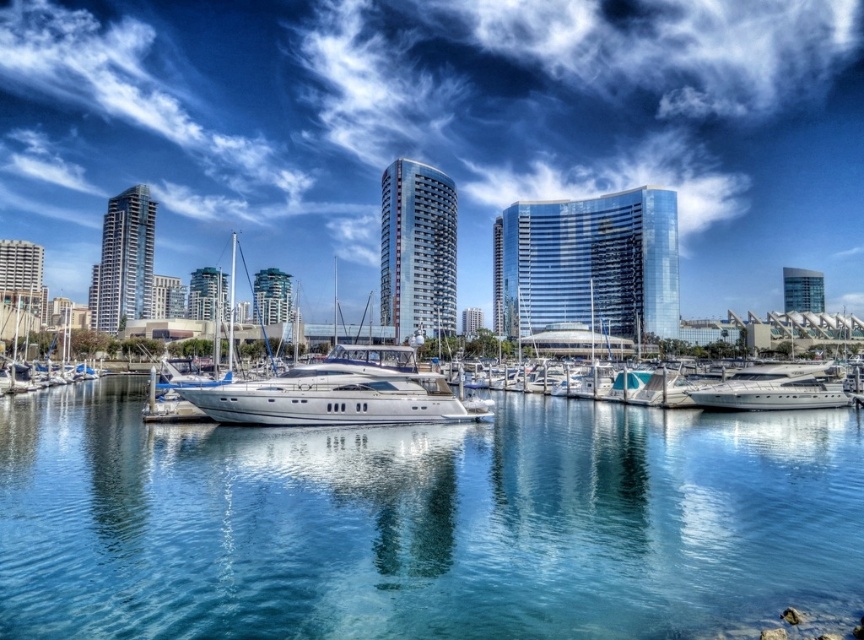
Which is in front, point (359, 348) or point (132, 312)?

Positioned in front is point (359, 348).

Does white glossy yacht at center have a smaller size compared to glassy skyscraper at left?

Yes.

Is point (481, 417) closer to viewer compared to point (105, 300)?

Yes, it is in front of point (105, 300).

Where is `white glossy yacht at center`? Image resolution: width=864 pixels, height=640 pixels. white glossy yacht at center is located at coordinates (337, 392).

Can you confirm if glossy glass building at center is wider than white glossy yacht at center?

Yes, glossy glass building at center is wider than white glossy yacht at center.

Can you confirm if glossy glass building at center is shorter than white glossy yacht at center?

No, glossy glass building at center is not shorter than white glossy yacht at center.

Which is in front, point (556, 236) or point (213, 408)?

Point (213, 408) is in front.

Where is `glossy glass building at center`? glossy glass building at center is located at coordinates tap(589, 262).

Which is more to the right, glassy blue skyscraper at center or glassy blue skyscraper at upper right?

From the viewer's perspective, glassy blue skyscraper at upper right appears more on the right side.

Between glassy blue skyscraper at center and glassy blue skyscraper at upper right, which one is positioned lower?

glassy blue skyscraper at center is lower down.

Is point (221, 316) closer to camera compared to point (785, 291)?

Yes.

At what (x,y) coordinates should I click in order to perform the action: click on glassy blue skyscraper at center. Please return your answer as a coordinate pair (x, y). Looking at the image, I should click on (207, 294).